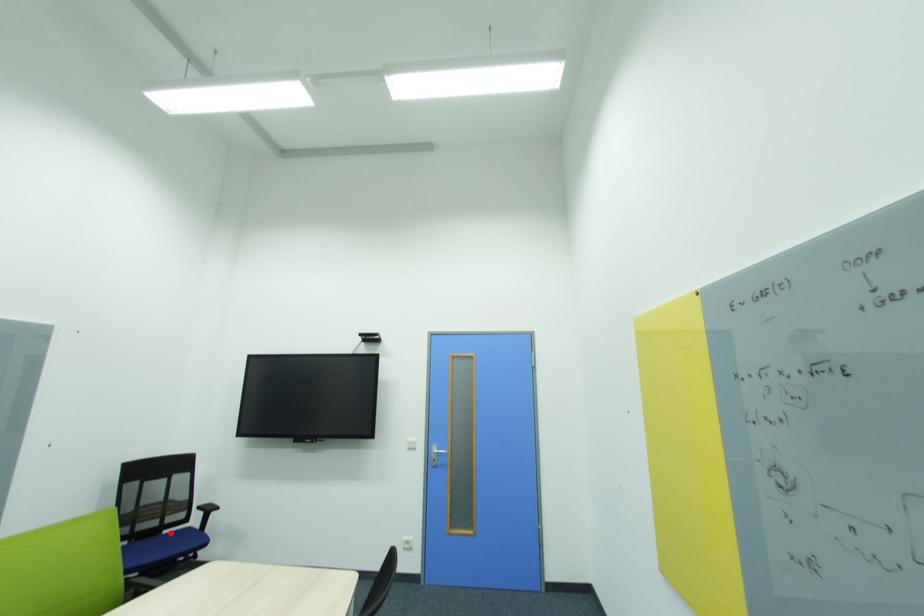
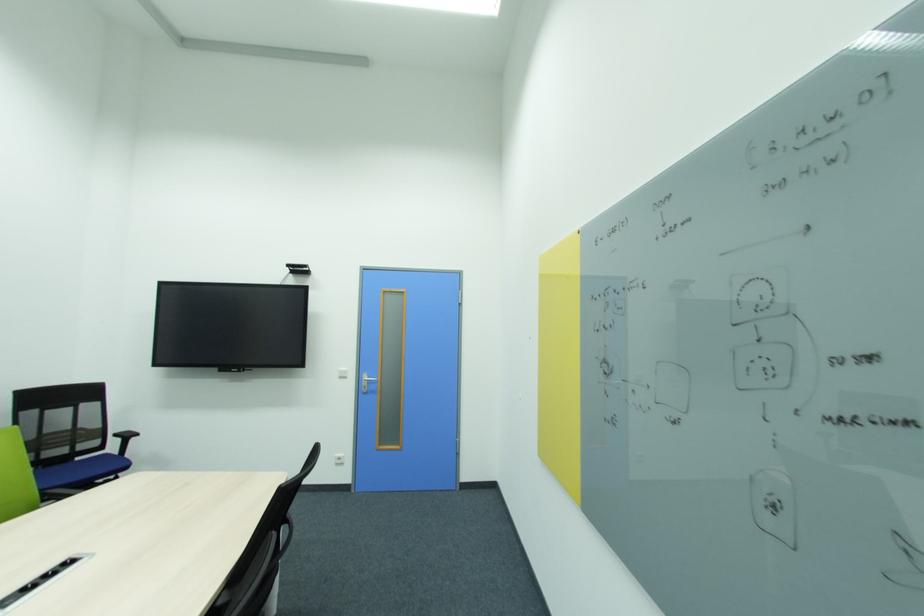
The point at the highlighted location is marked in the first image. Where is the corresponding point in the second image?

(82, 460)